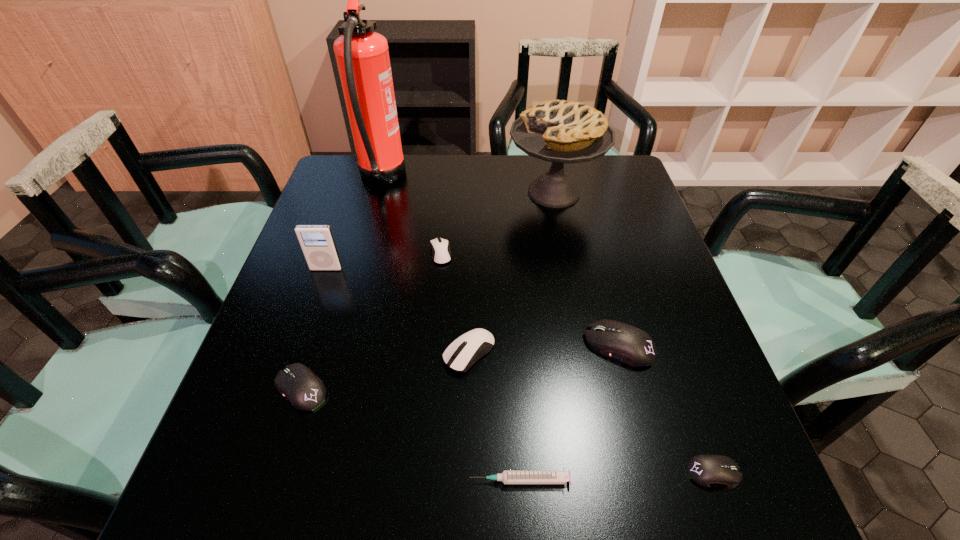
You are a GUI agent. You are given a task and a screenshot of the screen. Output one action in this format:
    pyautogui.click(x=<x>, y=<y>)
    Task: Click on the blank area located on the back of the bigger white mouse
    The height and width of the screenshot is (540, 960).
    Given the screenshot: What is the action you would take?
    pyautogui.click(x=471, y=242)

This screenshot has width=960, height=540. Find the location of `free space located on the back of the second biggest black computer equipment`. free space located on the back of the second biggest black computer equipment is located at coordinates (331, 292).

Locate an element on the screen. This screenshot has height=540, width=960. free point located on the left of the farthest computer equipment is located at coordinates (386, 253).

What are the coordinates of `vacant area situated 0.300m on the back of the nearest computer equipment` in the screenshot? It's located at (659, 320).

Where is `free location located 0.170m at the needle end of the white syringe`? The height and width of the screenshot is (540, 960). free location located 0.170m at the needle end of the white syringe is located at coordinates (367, 480).

Image resolution: width=960 pixels, height=540 pixels. Find the location of `vacant area situated at the needle end of the white syringe`. vacant area situated at the needle end of the white syringe is located at coordinates pos(313,480).

Find the location of a particular element. vacant space located 0.320m at the needle end of the white syringe is located at coordinates (276, 480).

Find the location of a particular element. fire extinguisher present at the far edge is located at coordinates (362, 55).

Find the location of a particular element. The image size is (960, 540). pie positioned at the far edge is located at coordinates (558, 131).

This screenshot has height=540, width=960. Identify the location of computer equipment located at the near edge. [x=706, y=470].